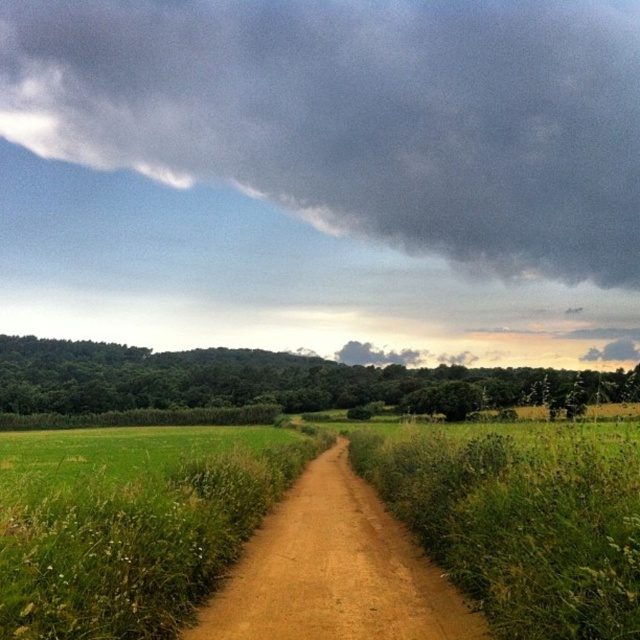
Between point (145, 168) and point (300, 557), which one is positioned behind?

The point (145, 168) is more distant.

Describe the element at coordinates (358, 115) in the screenshot. I see `dark gray cloud at upper center` at that location.

Locate an element on the screen. dark gray cloud at upper center is located at coordinates (358, 115).